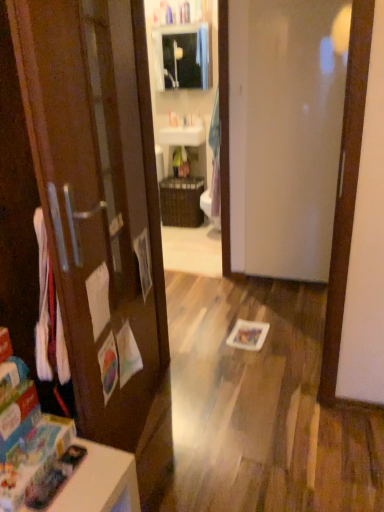
Where is `free point above white glossy table at lower left (from a real-world perspective)`? free point above white glossy table at lower left (from a real-world perspective) is located at coordinates (68, 477).